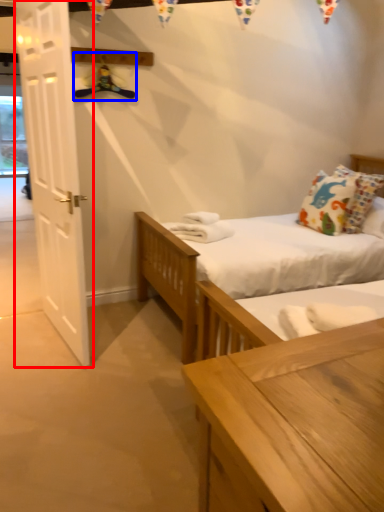
Question: Which of the following is the farthest to the observer, door (highlighted by a red box) or hanger (highlighted by a blue box)?

Choices:
 (A) door
 (B) hanger

Answer: (B)